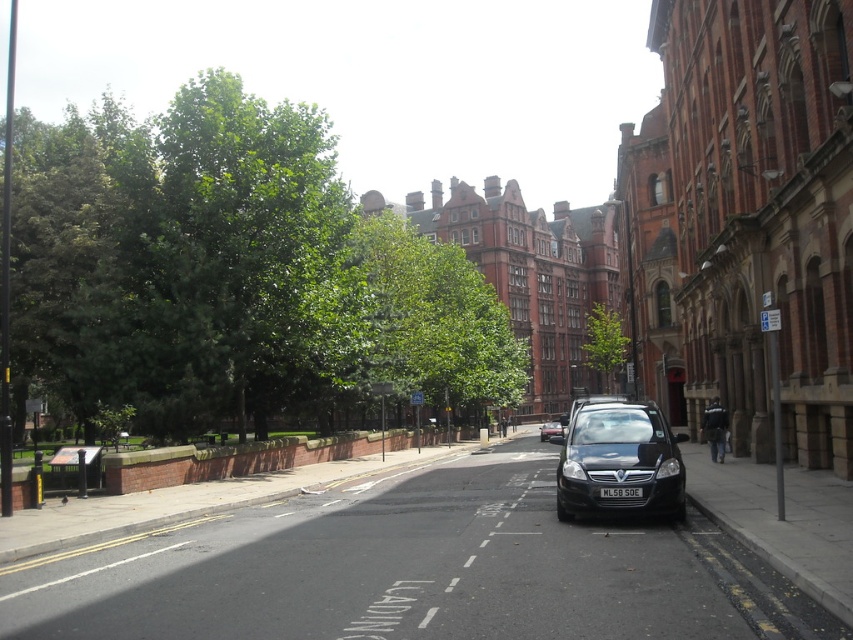
You are a pedestrian standing at the edge of the street. You see a shiny black car at center and a white plastic license plate at center. Which object is closer to you?

The shiny black car at center is closer to you because it is positioned further to the viewer than the white plastic license plate at center.

You are a delivery driver who needs to park your car with the white plastic license plate at center as close as possible to the green leafy tree at center. Given that the parking space must be at least 300 feet away from the tree to avoid damaging its roots, is it safe to park there?

The green leafy tree at center is 297.29 feet from the white plastic license plate at center. Since the required distance is 300 feet and the current distance is less than that, parking there would be too close and could damage the tree roots. Please choose a different parking spot further away.

You are a pedestrian standing at the edge of the street. You see a shiny black car at center and a black glossy car at center. Which car is nearer to you?

The shiny black car at center is closer to the viewer than the black glossy car at center.